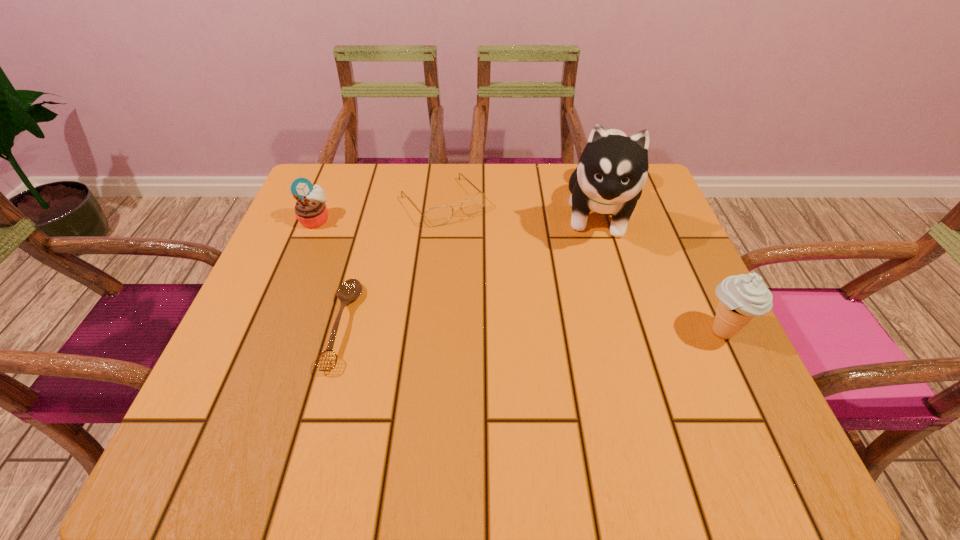
Image resolution: width=960 pixels, height=540 pixels. What are the coordinates of `free space between the second object from right to left and the rightmost object` in the screenshot? It's located at (660, 272).

Where is `vacant space in between the third object from right to left and the muffin`? vacant space in between the third object from right to left and the muffin is located at coordinates (379, 211).

Identify the location of free area in between the third shortest object and the ladle. (329, 273).

Find the location of a particular element. empty space between the third tallest object and the ladle is located at coordinates (329, 273).

Locate an element on the screen. vacant space in between the fourth object from right to left and the rightmost object is located at coordinates (532, 328).

Find the location of `vacant area that lies between the fourth shortest object and the second object from right to left`. vacant area that lies between the fourth shortest object and the second object from right to left is located at coordinates (660, 272).

Locate which object ranks fourth in proximity to the spectacles. Please provide its 2D coordinates. Your answer should be formatted as a tuple, i.e. [(x, y)], where the tuple contains the x and y coordinates of a point satisfying the conditions above.

[(742, 297)]

At what (x,y) coordinates should I click in order to perform the action: click on object that can be found as the second closest to the shortest object. Please return your answer as a coordinate pair (x, y). Image resolution: width=960 pixels, height=540 pixels. Looking at the image, I should click on (310, 209).

At what (x,y) coordinates should I click in order to perform the action: click on blank space that satisfies the following two spatial constraints: 1. on the front side of the puppy; 2. on the left side of the second tallest object. Please return your answer as a coordinate pair (x, y). Looking at the image, I should click on (636, 332).

The width and height of the screenshot is (960, 540). Find the location of `free space that satisfies the following two spatial constraints: 1. on the front side of the muffin; 2. on the right side of the icecream`. free space that satisfies the following two spatial constraints: 1. on the front side of the muffin; 2. on the right side of the icecream is located at coordinates (269, 332).